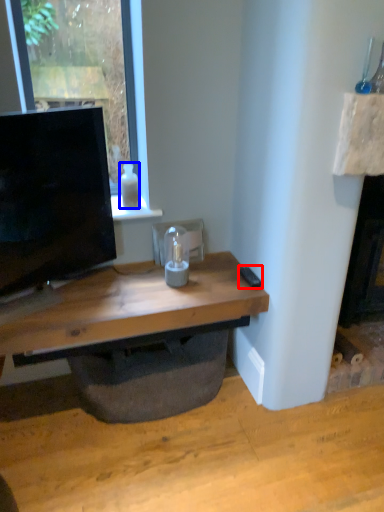
Question: Among these objects, which one is farthest to the camera, remote control (highlighted by a red box) or bottle (highlighted by a blue box)?

Choices:
 (A) remote control
 (B) bottle

Answer: (B)